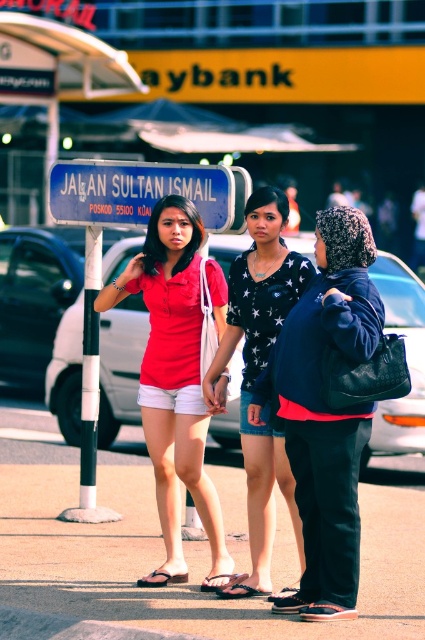
You are a photographer standing at the center of the scene. You want to take a photo of the black leather jacket at center. Where should you point your camera to capture it?

You should point your camera to the coordinates at point (325,412) to capture the black leather jacket at center.

You are a fashion designer observing the individuals in the scene. You notice the matte red shirt at center and the denim shorts at center. Which clothing item is located to the left of the other?

The matte red shirt at center is positioned on the left side of denim shorts at center, so the matte red shirt at center is to the left of the denim shorts at center.